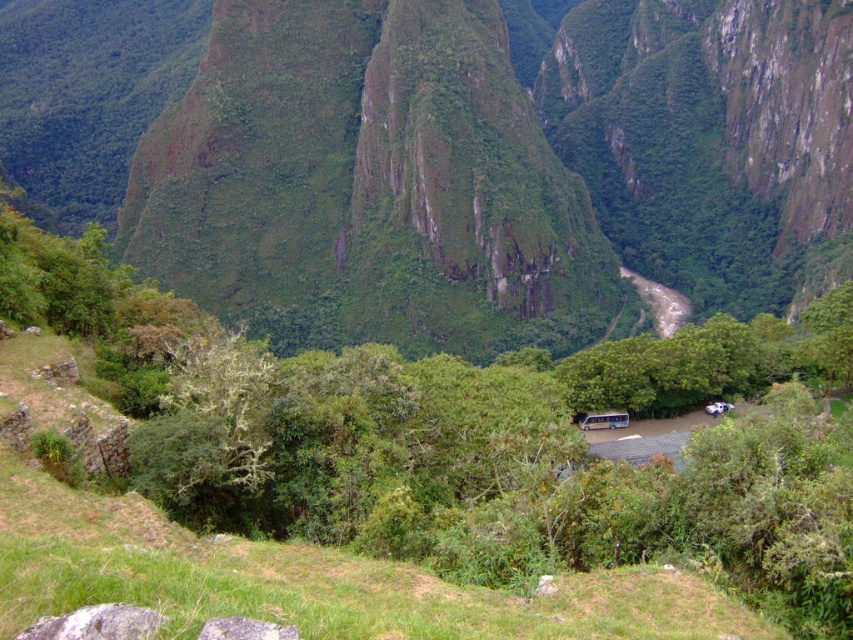
Does green leafy trees at center lie in front of brown rocky river at center?

Yes, it is.

How far apart are green leafy trees at center and brown rocky river at center?

green leafy trees at center and brown rocky river at center are 166.57 meters apart from each other.

Identify the location of green leafy trees at center. (422, 452).

Where is `green leafy trees at center`? green leafy trees at center is located at coordinates (422, 452).